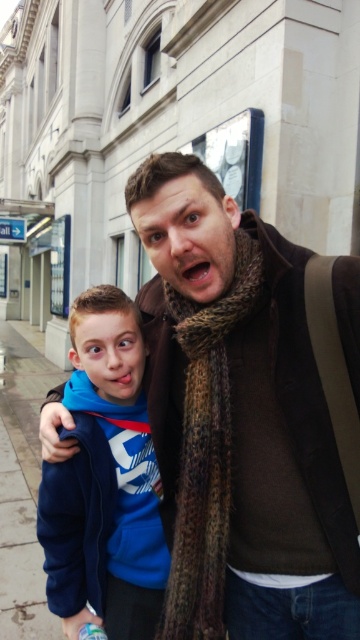
Does point (249, 337) lie behind point (149, 557)?

No, (249, 337) is closer to viewer.

Between point (271, 230) and point (144, 579), which one is positioned behind?

The point (144, 579) is behind.

In order to click on brown knitted scarf at center in this screenshot , I will do `click(245, 413)`.

You are a GUI agent. You are given a task and a screenshot of the screen. Output one action in this format:
    pyautogui.click(x=<x>, y=<y>)
    Task: Click on the brown knitted scarf at center
    
    Given the screenshot: What is the action you would take?
    pyautogui.click(x=245, y=413)

Between brown knitted scarf at center and brown textured scarf at center, which one appears on the left side from the viewer's perspective?

brown textured scarf at center is more to the left.

Does point (176, 333) lie behind point (222, 536)?

Yes.

Which is behind, point (168, 378) or point (191, 378)?

The point (168, 378) is behind.

Find the location of a particular element. brown knitted scarf at center is located at coordinates (245, 413).

Is blue fleece jacket at left positioned in front of gray concrete pavement at lower left?

Yes, it is in front of gray concrete pavement at lower left.

Does point (92, 353) come farther from viewer compared to point (15, 476)?

No, it is not.

The width and height of the screenshot is (360, 640). I want to click on blue fleece jacket at left, so click(122, 452).